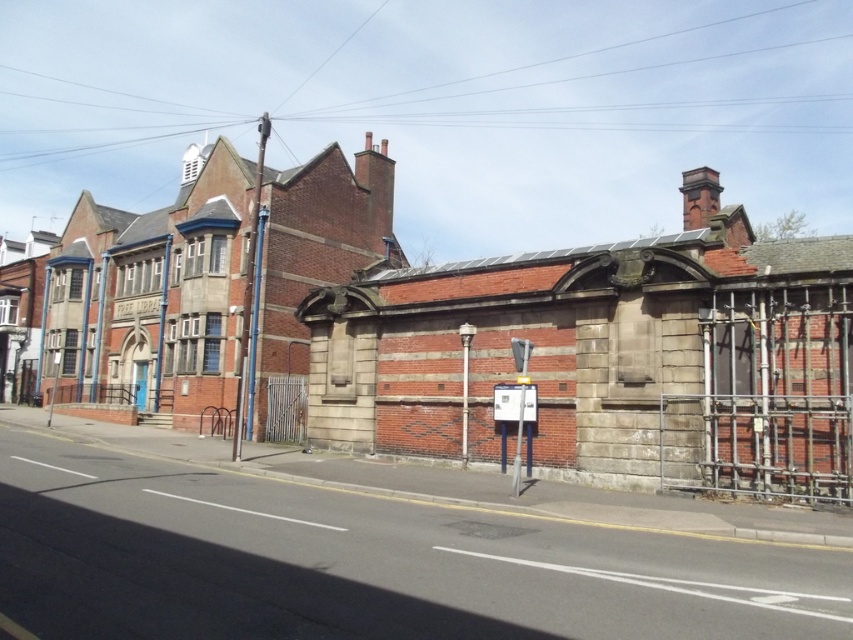
You are standing in front of the historic brick library. You want to take a photo of the entrance without the metallic scaffolding at right appearing in the frame. Is it possible to do so by moving closer to the library?

The metallic scaffolding at right is 12.64 meters away from the viewer. Moving closer to the library would reduce the distance, but since the scaffolding is part of the building structure, it might still be visible unless you move far enough to the side or use a wide angle lens. However, based on the given distance alone, moving closer may not be sufficient to exclude the scaffolding from the frame.

You are a delivery person who needs to place a 5 meter long ladder between the metallic scaffolding at right and the metallic gray sign at center. Can the ladder fit between them without bending?

The distance between the metallic scaffolding at right and the metallic gray sign at center is 4.51 meters. Since the ladder is 5 meters long, it cannot fit between them without bending.

You are a delivery person who needs to park a van that is 3 meters wide. You see the metallic scaffolding at right in the image. Can you park your van near the scaffolding without blocking the library entrance?

The position of metallic scaffolding at right is at point (776, 394), which is far from the library entrance, so yes, you can park your van near the scaffolding without blocking the library entrance.